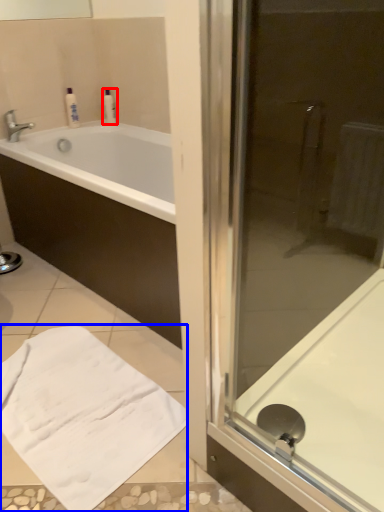
Question: Which point is further to the camera, toiletry (highlighted by a red box) or bath towel (highlighted by a blue box)?

Choices:
 (A) toiletry
 (B) bath towel

Answer: (A)